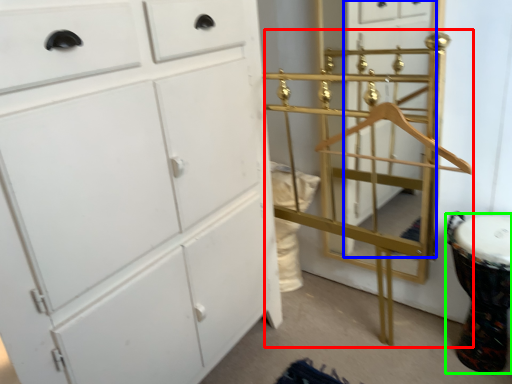
Question: Which object is positioned farthest from bunk bed (highlighted by a red box)? Select from glass door (highlighted by a blue box) and drum (highlighted by a green box).

Choices:
 (A) glass door
 (B) drum

Answer: (B)